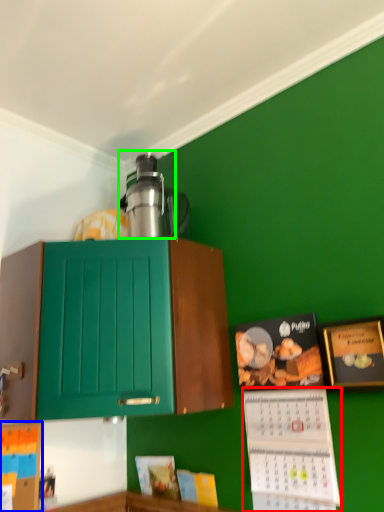
Question: Which is farther away from book (highlighted by a red box)? book (highlighted by a blue box) or appliance (highlighted by a green box)?

Choices:
 (A) book
 (B) appliance

Answer: (A)